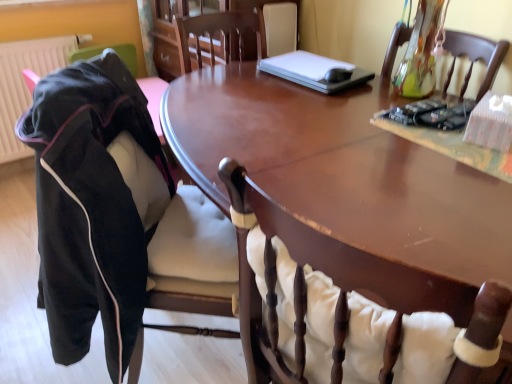
Question: Looking at the image, does white plastic laptop at upper center seem bigger or smaller compared to suede-like black jacket at left, which is the second chair from right to left?

Choices:
 (A) small
 (B) big

Answer: (A)

Question: Is white plastic laptop at upper center inside the boundaries of suede-like black jacket at left, arranged as the first chair when viewed from the left, or outside?

Choices:
 (A) inside
 (B) outside

Answer: (B)

Question: Which of these objects is positioned closest to the suede-like black jacket at left, arranged as the first chair when viewed from the left?

Choices:
 (A) white plastic laptop at upper center
 (B) matte plastic radiator at left
 (C) wooden chair at center, which ranks as the 2th chair in left-to-right order
 (D) glossy wood table at center

Answer: (D)

Question: Which object is the closest to the wooden chair at center, the first chair positioned from the right?

Choices:
 (A) matte plastic radiator at left
 (B) glossy wood table at center
 (C) suede-like black jacket at left, arranged as the first chair when viewed from the left
 (D) white plastic laptop at upper center

Answer: (B)